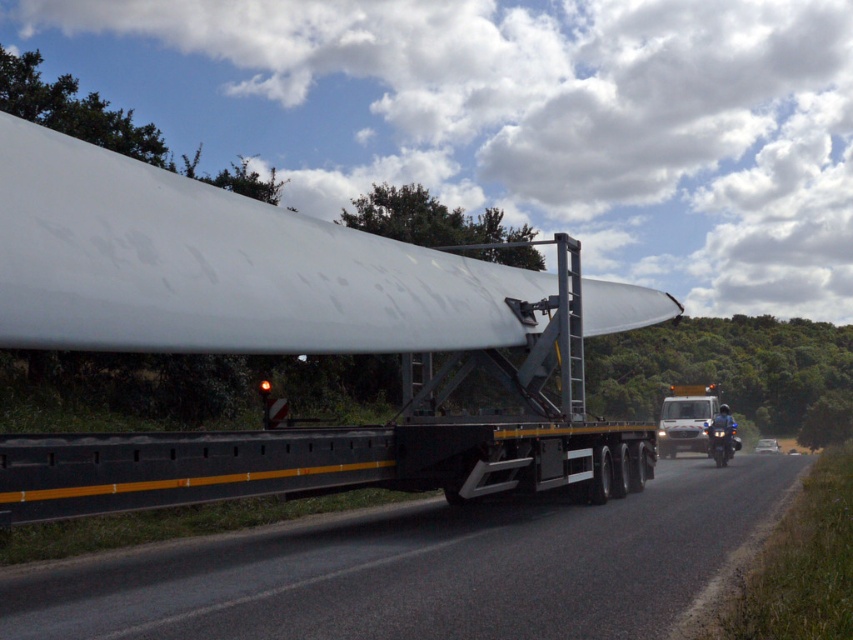
Question: Observing the image, what is the correct spatial positioning of white matte wind turbine blade at center in reference to black asphalt road at center?

Choices:
 (A) left
 (B) right

Answer: (A)

Question: Which point is closer to the camera taking this photo?

Choices:
 (A) 83,636
 (B) 518,307

Answer: (A)

Question: Can you confirm if white matte wind turbine blade at center is positioned above black asphalt road at center?

Choices:
 (A) no
 (B) yes

Answer: (B)

Question: Can you confirm if white matte wind turbine blade at center is positioned below black asphalt road at center?

Choices:
 (A) yes
 (B) no

Answer: (B)